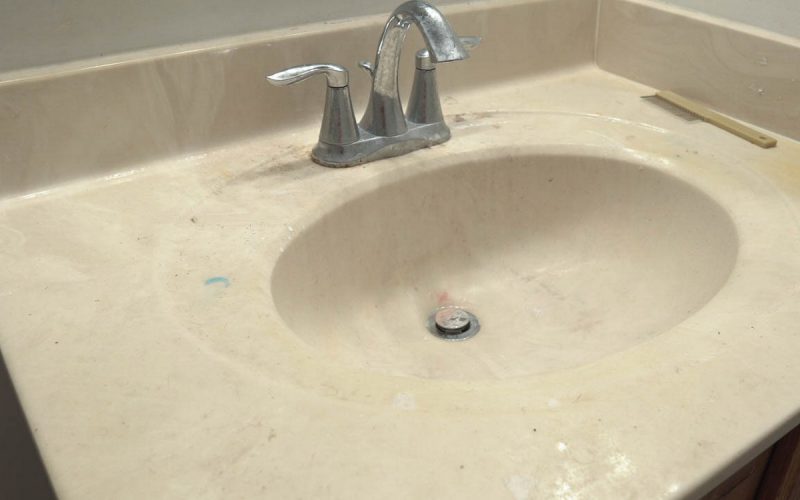
Locate an element on the screen. The image size is (800, 500). waterstains is located at coordinates (382, 52), (424, 2).